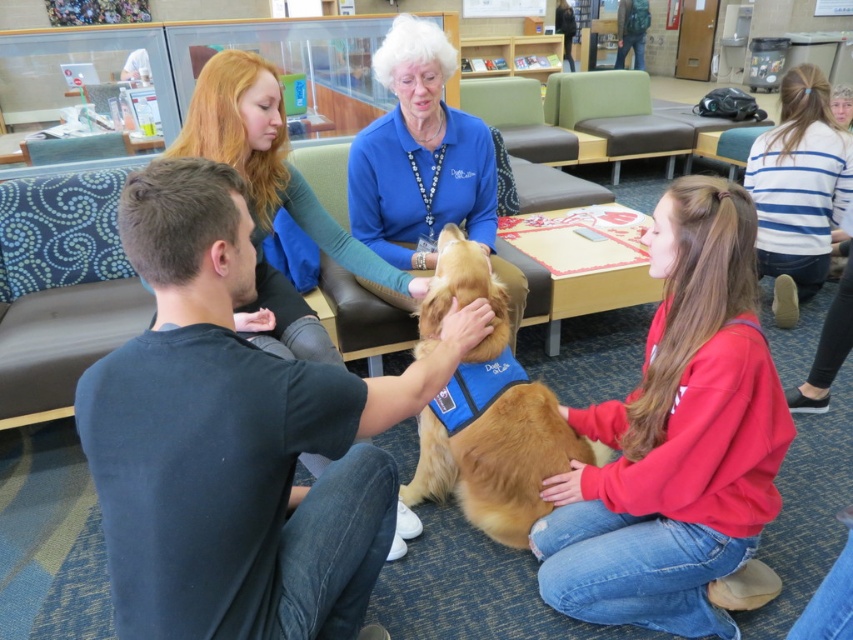
Question: Which point is closer to the camera?

Choices:
 (A) (242, 177)
 (B) (660, 524)
 (C) (178, 374)

Answer: (C)

Question: Is golden fur dog at center positioned at the back of blue striped sweater at upper right?

Choices:
 (A) no
 (B) yes

Answer: (A)

Question: Can you confirm if dark blue shirt at center is bigger than golden fur dog at center?

Choices:
 (A) no
 (B) yes

Answer: (B)

Question: In this image, where is dark blue shirt at center located relative to red fleece sweatshirt at lower right?

Choices:
 (A) below
 (B) above

Answer: (A)

Question: Which point appears closest to the camera in this image?

Choices:
 (A) (584, 513)
 (B) (773, 188)

Answer: (A)

Question: Which point appears closest to the camera in this image?

Choices:
 (A) (312, 348)
 (B) (791, 253)
 (C) (254, 508)

Answer: (C)